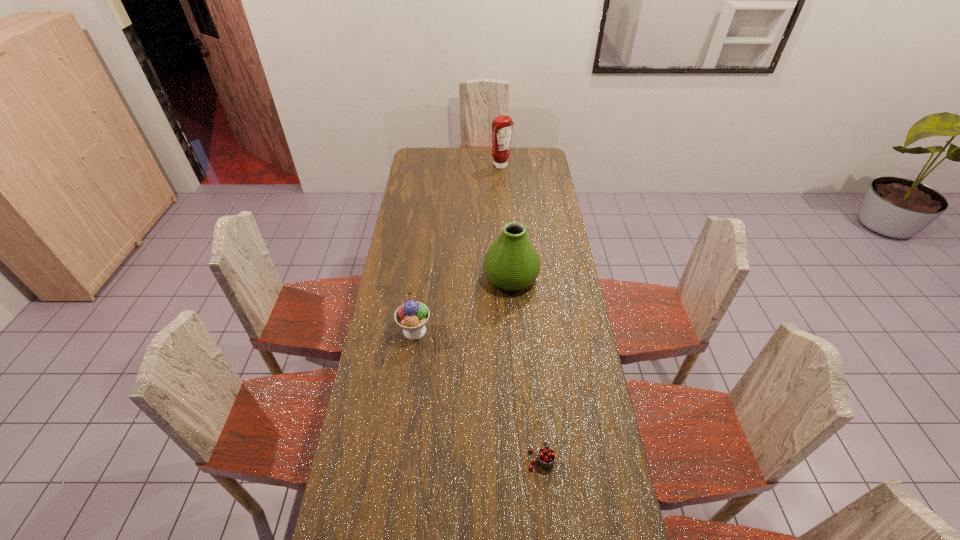
At what (x,y) coordinates should I click in order to perform the action: click on condiment. Please return your answer as a coordinate pair (x, y). The height and width of the screenshot is (540, 960). Looking at the image, I should click on (502, 126).

The height and width of the screenshot is (540, 960). What are the coordinates of `the third nearest object` in the screenshot? It's located at (511, 263).

Find the location of a particular element. The width and height of the screenshot is (960, 540). icecream is located at coordinates (412, 316).

Where is `the leftmost object`? The height and width of the screenshot is (540, 960). the leftmost object is located at coordinates (412, 316).

This screenshot has height=540, width=960. I want to click on cherry, so click(x=546, y=455).

Locate an element on the screen. The image size is (960, 540). the nearest object is located at coordinates (546, 455).

In order to click on vacant area situated 0.210m on the left of the condiment in this screenshot , I will do `click(454, 166)`.

At what (x,y) coordinates should I click in order to perform the action: click on free space located 0.080m on the back of the vase. Please return your answer as a coordinate pair (x, y). The width and height of the screenshot is (960, 540). Looking at the image, I should click on pyautogui.click(x=509, y=246).

Locate an element on the screen. The height and width of the screenshot is (540, 960). free spot located on the back of the icecream is located at coordinates (422, 269).

Locate an element on the screen. The width and height of the screenshot is (960, 540). vacant region located 0.300m on the handle side of the cherry is located at coordinates (532, 363).